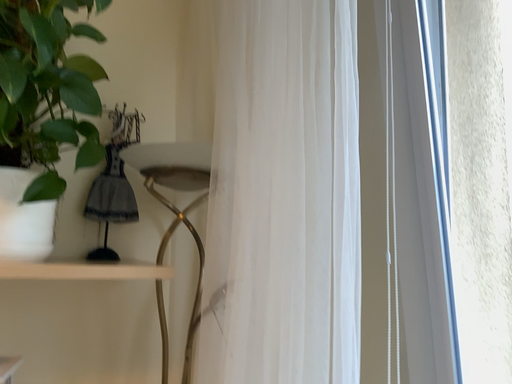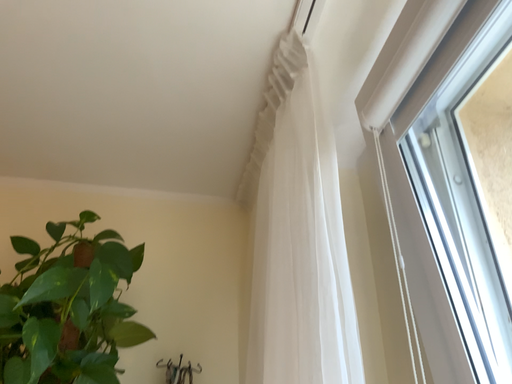
Question: Which way did the camera rotate in the video?

Choices:
 (A) rotated right
 (B) rotated left

Answer: (B)